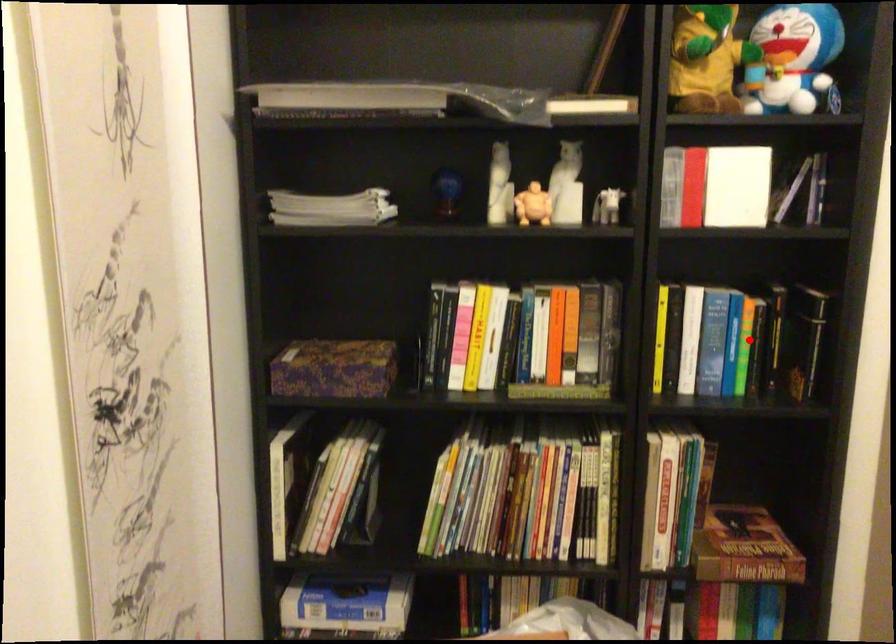
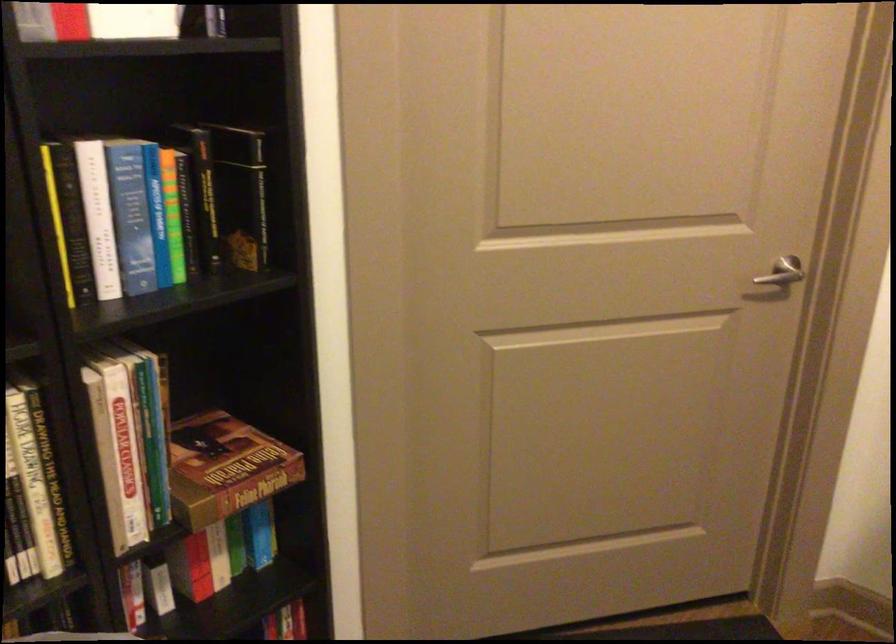
In the second image, find the point that corresponds to the highlighted location in the first image.

(171, 214)